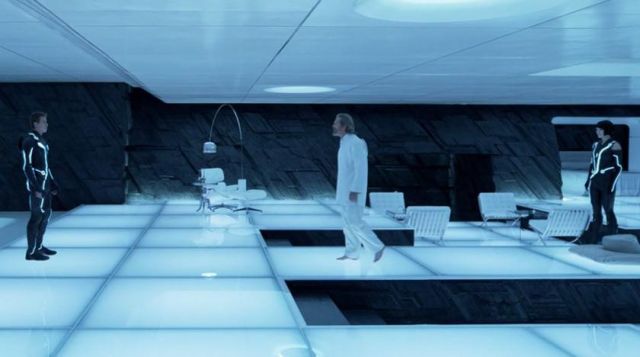
Where is `gray wall`? gray wall is located at coordinates (161, 165).